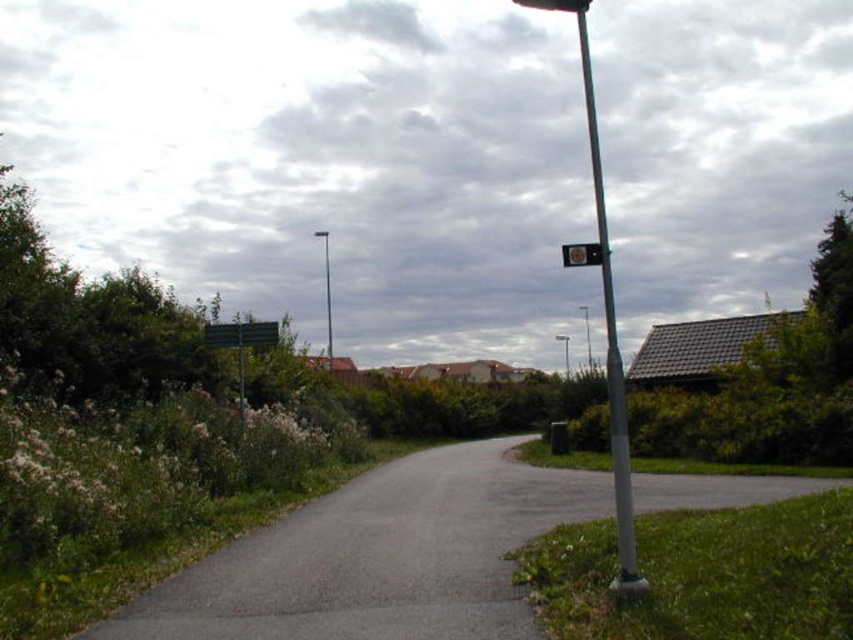
Can you confirm if asphalt road at center is wider than silver metallic pole at right?

In fact, asphalt road at center might be narrower than silver metallic pole at right.

In the scene shown: Is asphalt road at center shorter than silver metallic pole at right?

Yes, asphalt road at center is shorter than silver metallic pole at right.

What do you see at coordinates (379, 556) in the screenshot?
I see `asphalt road at center` at bounding box center [379, 556].

The width and height of the screenshot is (853, 640). Identify the location of asphalt road at center. (379, 556).

Between silver metallic pole at right and metallic rectangular sign at upper center, which one has less height?

Standing shorter between the two is metallic rectangular sign at upper center.

Does silver metallic pole at right have a greater height compared to metallic rectangular sign at upper center?

Yes, silver metallic pole at right is taller than metallic rectangular sign at upper center.

Which is behind, point (631, 524) or point (595, 253)?

Point (595, 253)

Identify the location of silver metallic pole at right. This screenshot has height=640, width=853. (x=610, y=342).

Is asphalt road at center closer to camera compared to metallic pole at center?

Answer: Yes, asphalt road at center is in front of metallic pole at center.

Which is more to the right, asphalt road at center or metallic pole at center?

asphalt road at center

Does point (300, 509) come farther from viewer compared to point (328, 307)?

No, (300, 509) is in front of (328, 307).

I want to click on asphalt road at center, so click(x=379, y=556).